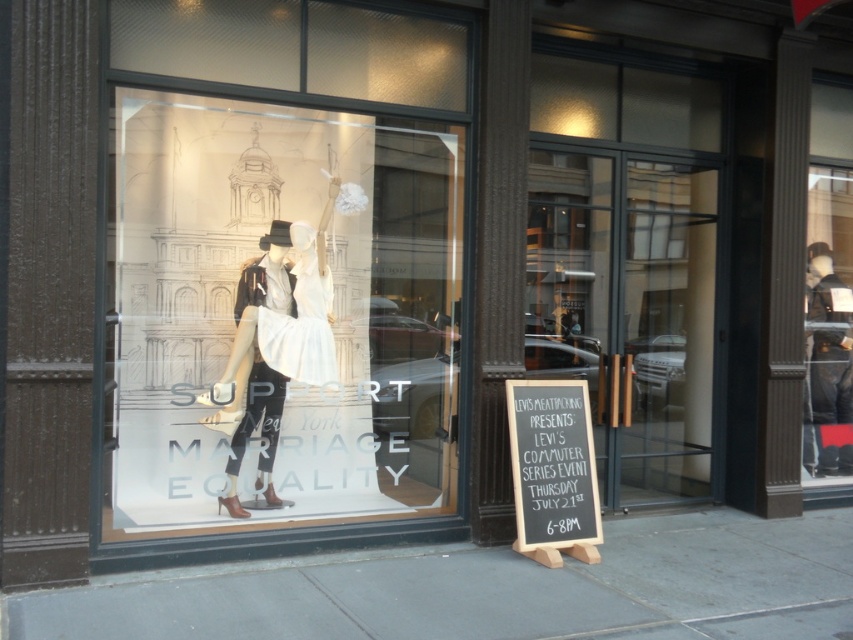
Question: Does matte glass mannequins at center appear on the right side of white satin dress at center?

Choices:
 (A) no
 (B) yes

Answer: (B)

Question: Does matte glass mannequins at center have a larger size compared to white satin dress at center?

Choices:
 (A) yes
 (B) no

Answer: (A)

Question: Considering the real-world distances, which object is closest to the black chalkboard at lower right?

Choices:
 (A) white satin dress at center
 (B) white matte dress at center
 (C) matte glass mannequins at center

Answer: (C)

Question: From the image, what is the correct spatial relationship of matte glass mannequins at center in relation to white matte dress at center?

Choices:
 (A) above
 (B) below

Answer: (A)

Question: Which object is farther from the camera taking this photo?

Choices:
 (A) white satin dress at center
 (B) black chalkboard at lower right

Answer: (A)

Question: Which object is farther from the camera taking this photo?

Choices:
 (A) white satin dress at center
 (B) white matte dress at center
 (C) matte glass mannequins at center
 (D) black chalkboard at lower right

Answer: (A)